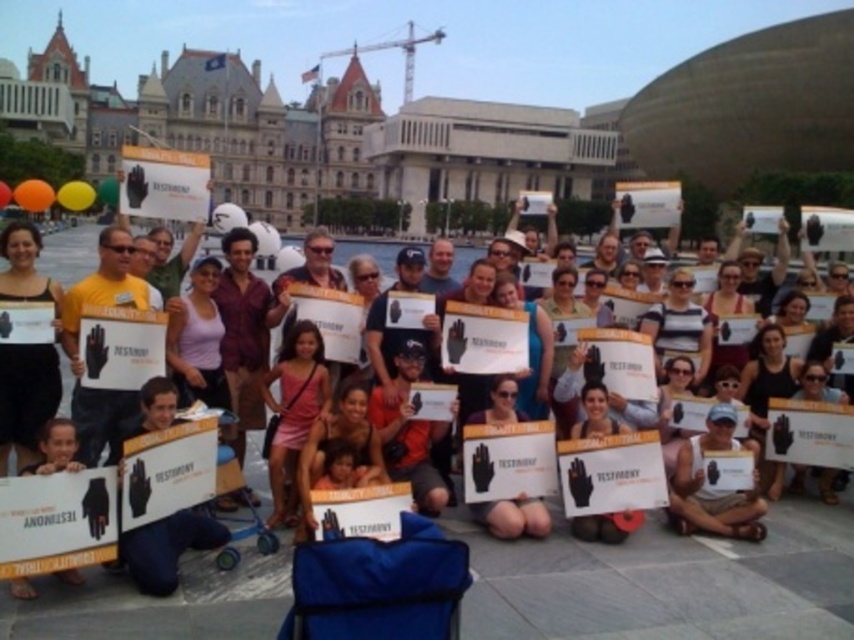
Question: Among these objects, which one is nearest to the camera?

Choices:
 (A) white cotton tank top at center
 (B) matte black glove at center
 (C) matte black sign at center

Answer: (C)

Question: Is matte black sign at center to the left of white cotton tank top at center from the viewer's perspective?

Choices:
 (A) no
 (B) yes

Answer: (B)

Question: Can you confirm if matte black sign at center is bigger than matte black hand at lower left?

Choices:
 (A) yes
 (B) no

Answer: (A)

Question: Which point is farther to the camera?

Choices:
 (A) (130, 544)
 (B) (718, 496)
 (C) (537, 529)
 (D) (114, 600)

Answer: (B)

Question: Is matte black sign at center smaller than matte black sign at lower left?

Choices:
 (A) yes
 (B) no

Answer: (B)

Question: Which object appears closest to the camera in this image?

Choices:
 (A) matte black sign at center
 (B) matte black sign at lower left
 (C) white cotton tank top at center

Answer: (A)